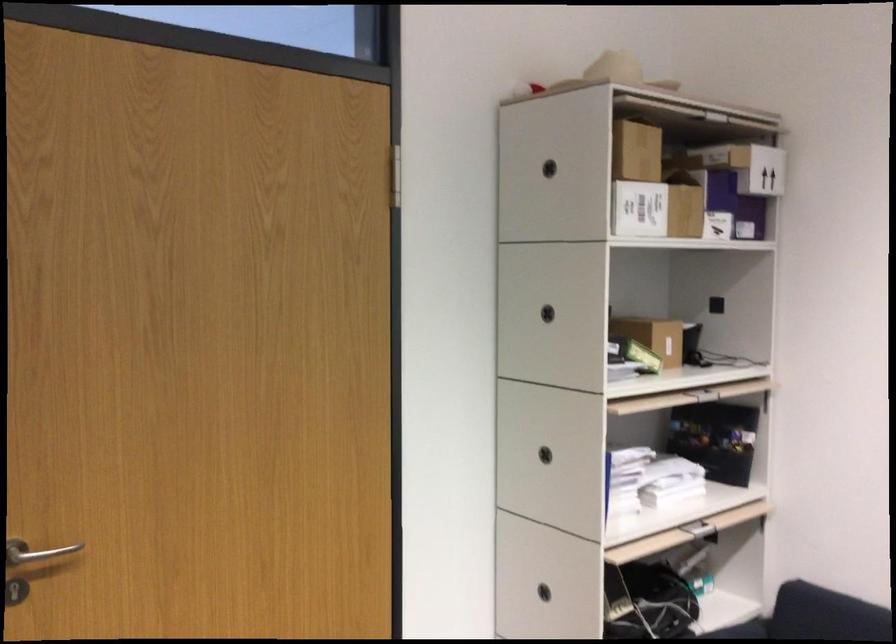
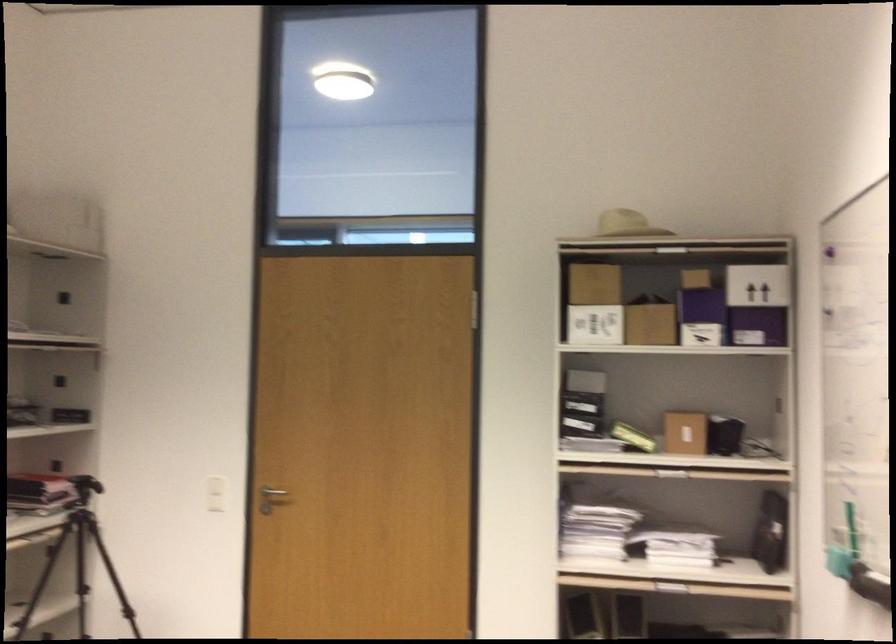
Locate, in the second image, the point that corresponds to pixel 631 359 in the first image.

(633, 437)